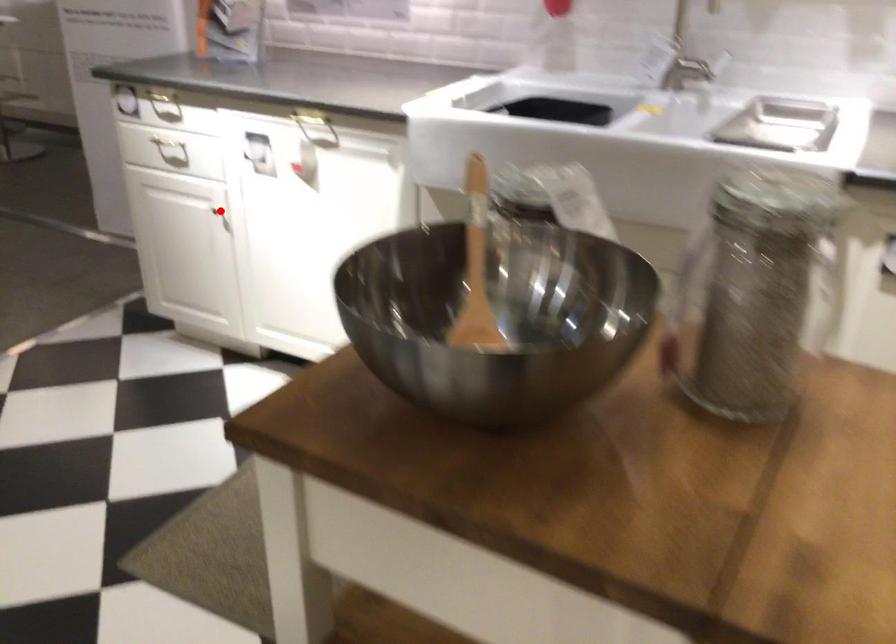
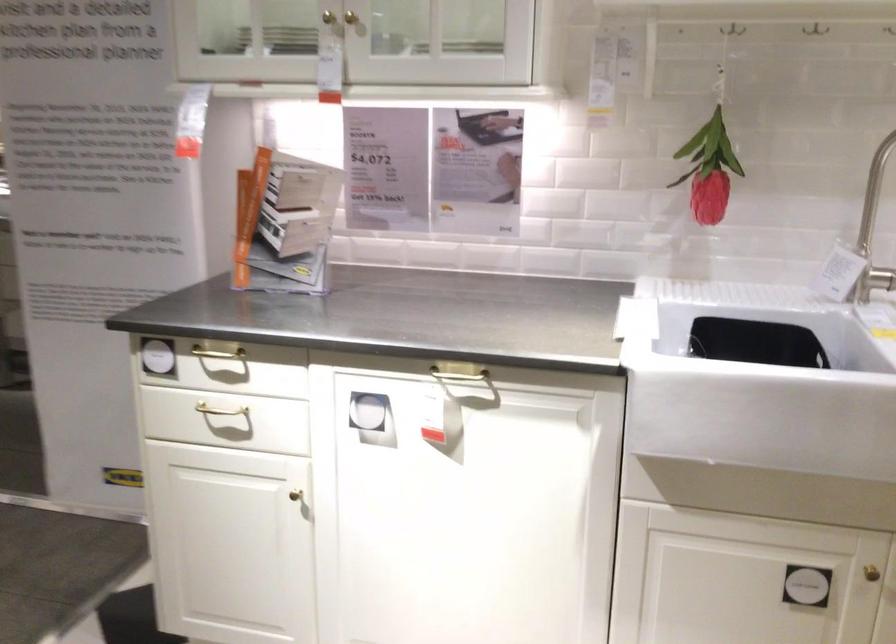
Where in the second image is the point corresponding to the highlighted location from the first image?

(296, 496)